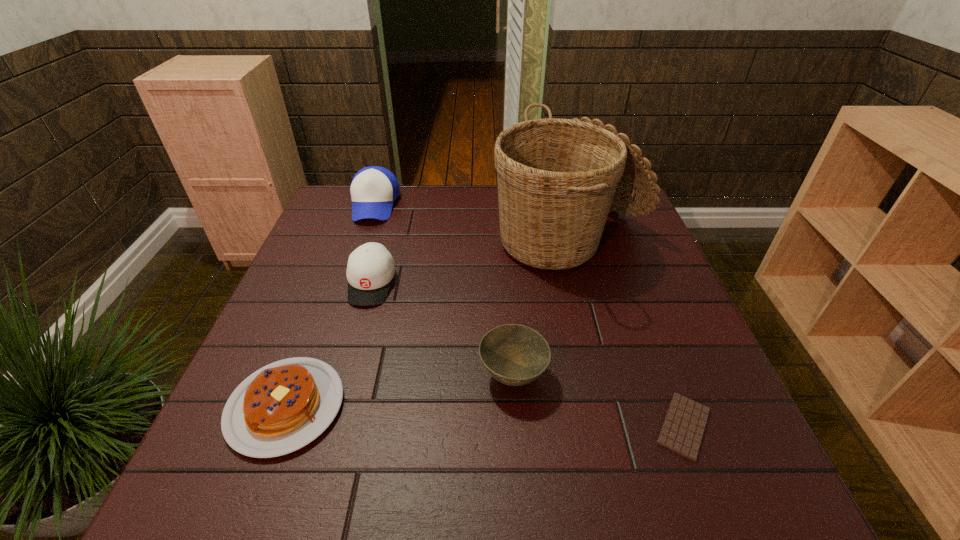
Locate an element on the screen. This screenshot has height=540, width=960. vacant space that satisfies the following two spatial constraints: 1. on the front-facing side of the chocolate bar; 2. on the right side of the farther baseball cap is located at coordinates (299, 426).